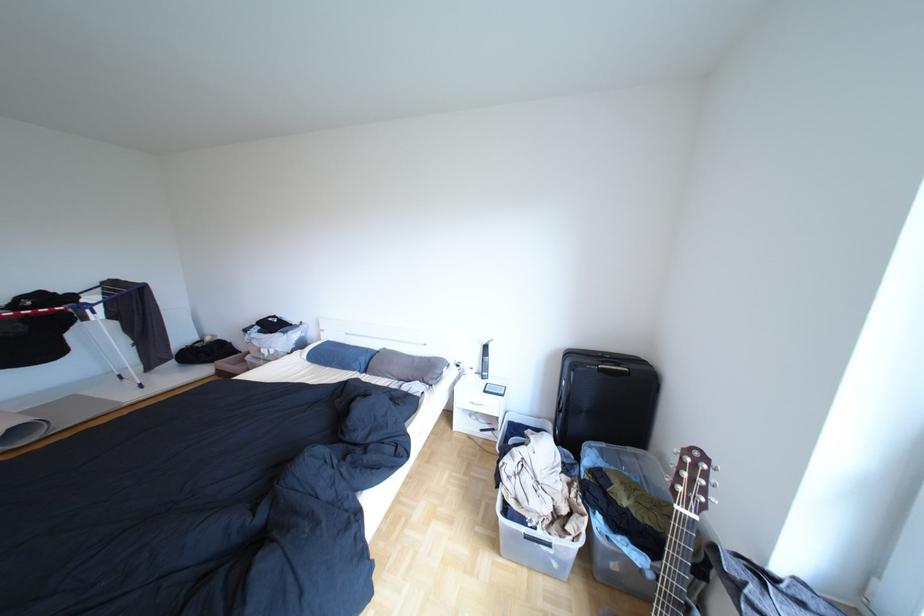
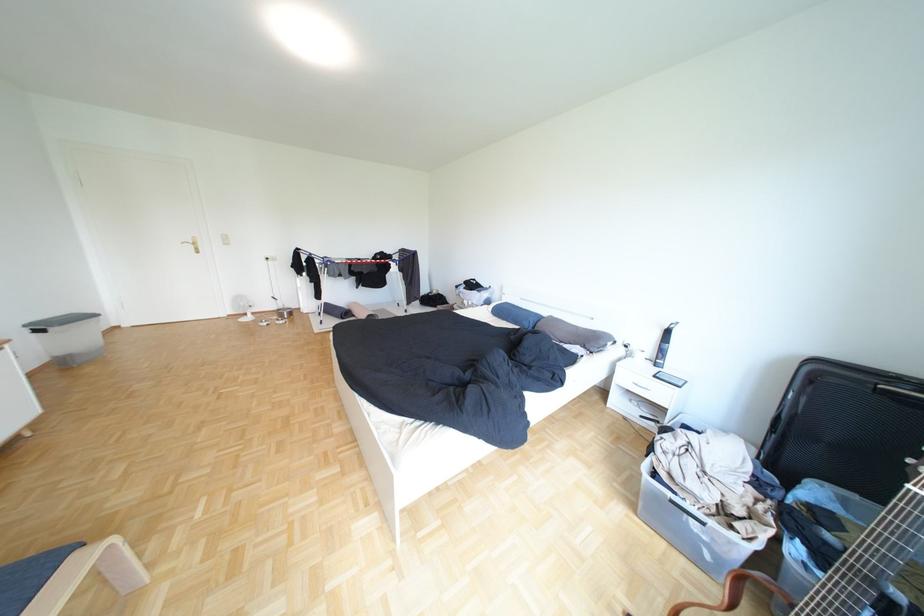
Question: The camera is either moving clockwise (left) or counter-clockwise (right) around the object. The first image is from the beginning of the video and the second image is from the end. Is the camera moving left or right when shooting the video?

Choices:
 (A) Left
 (B) Right

Answer: (B)